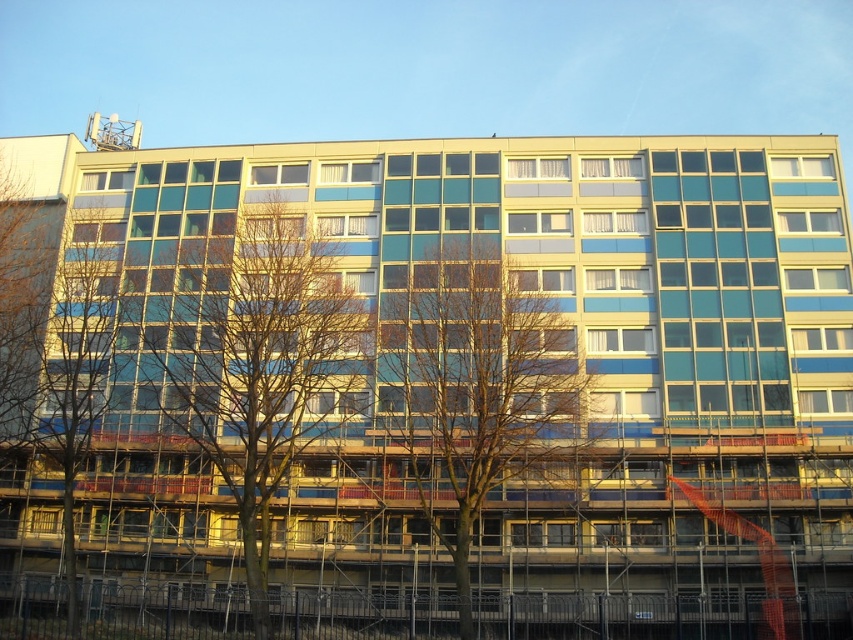
You are standing in front of the building and see the green leafy tree at center and the bare wood tree at center. Which tree is positioned to the left side?

The green leafy tree at center is positioned to the left of the bare wood tree at center.

You are standing in front of the multi story building and want to take a photo of the green leafy tree at center and the bare wood tree at left. Which tree should you focus on first if you want both trees to be in clear focus?

You should focus on the green leafy tree at center first because it is closer to the viewer than the bare wood tree at left, so adjusting focus from near to far will help both be in clear focus.

You are a landscape architect designing a garden around the building. You have two trees to place in the center area. Which tree has a wider spread when viewed from above? The green leafy tree at center or the bare wood tree at center?

The green leafy tree at center has a wider spread than the bare wood tree at center when viewed from above because its width surpasses the other.